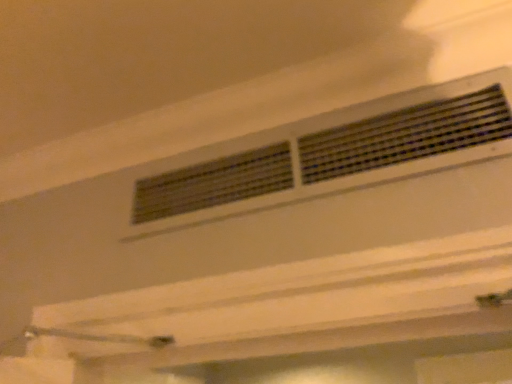
Describe the element at coordinates (329, 153) in the screenshot. I see `metallic silver air conditioning at center` at that location.

You are a GUI agent. You are given a task and a screenshot of the screen. Output one action in this format:
    pyautogui.click(x=<x>, y=<y>)
    Task: Click on the metallic silver air conditioning at center
    The width and height of the screenshot is (512, 384).
    Given the screenshot: What is the action you would take?
    pyautogui.click(x=329, y=153)

Locate an element on the screen. The height and width of the screenshot is (384, 512). metallic silver air conditioning at center is located at coordinates [329, 153].